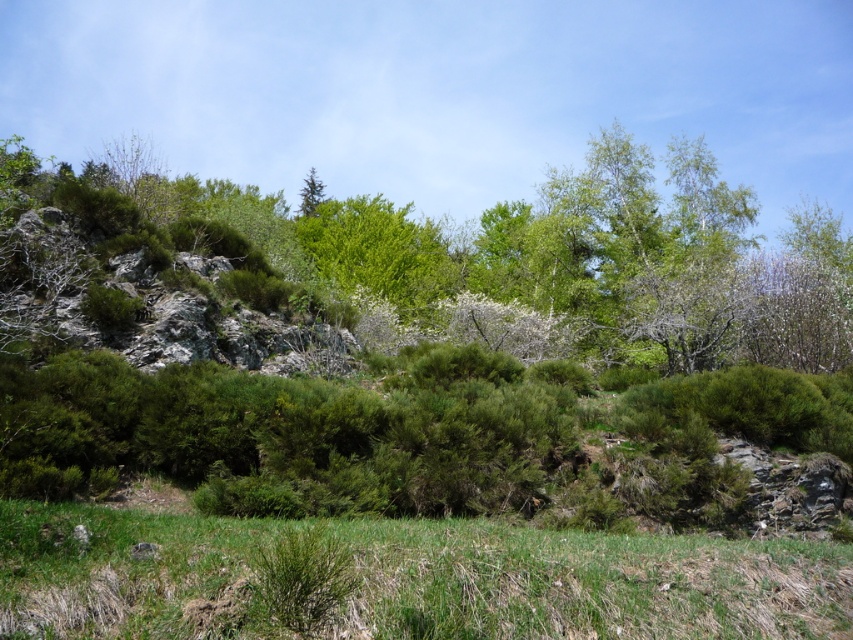
You are an explorer trying to determine which tree to climb first. You see a green leafy tree at upper center and a green matte tree at upper center. Which tree is closer to you?

The green leafy tree at upper center is closer to the viewer than the green matte tree at upper center, so you should climb the green leafy tree at upper center first.